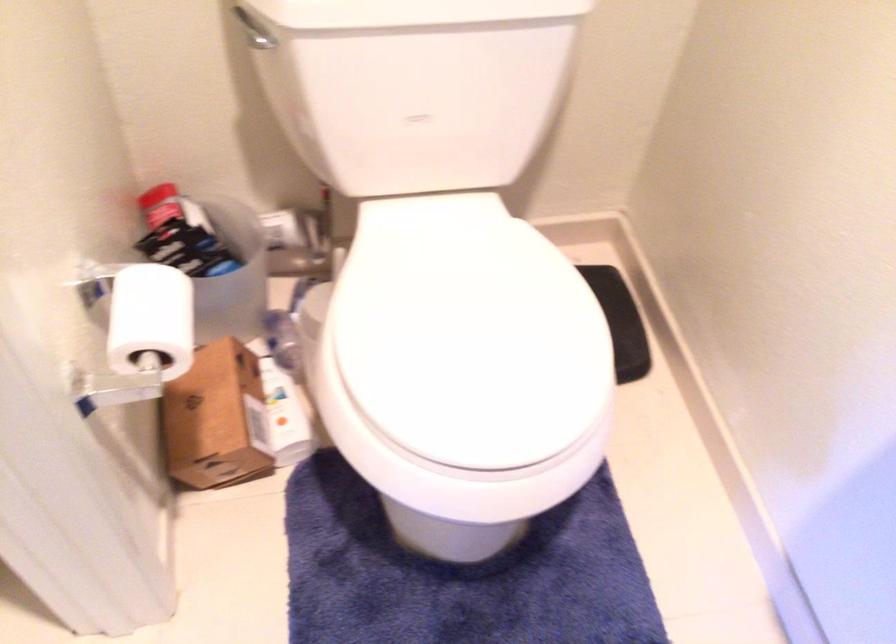
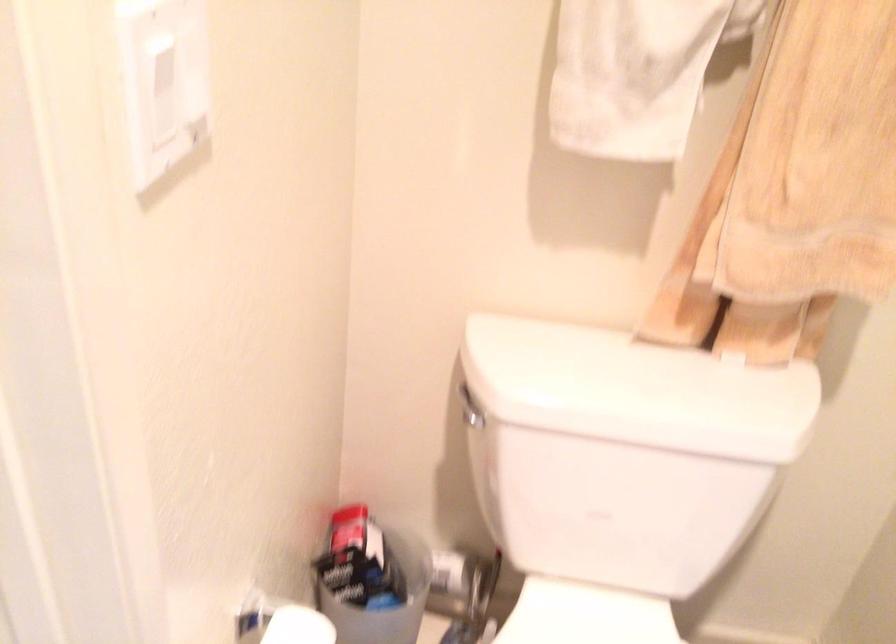
How did the camera likely rotate?

The camera's rotation is toward left-up.